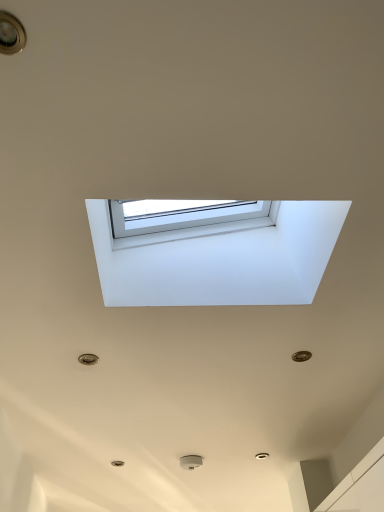
This screenshot has width=384, height=512. Describe the element at coordinates (220, 258) in the screenshot. I see `white plastic window at center` at that location.

This screenshot has width=384, height=512. Find the location of `white plastic window at center`. white plastic window at center is located at coordinates (220, 258).

The height and width of the screenshot is (512, 384). I want to click on white plastic window at center, so click(x=220, y=258).